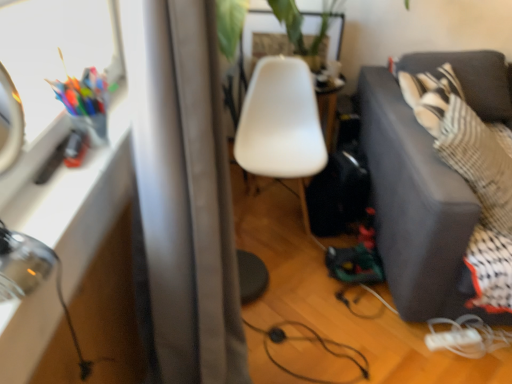
The image size is (512, 384). I want to click on vacant area that is situated to the right of white matte extension cord at lower right, so click(x=488, y=350).